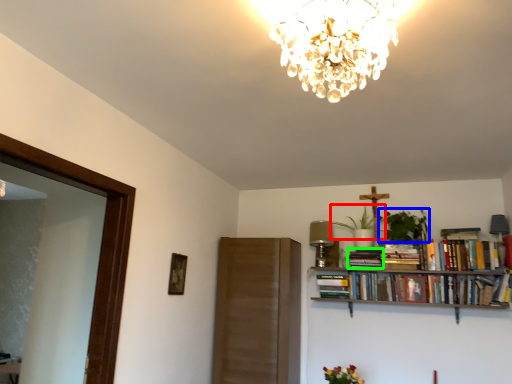
Question: Estimate the real-world distances between objects in this image. Which object is closer to plant (highlighted by a red box), plant (highlighted by a blue box) or book (highlighted by a green box)?

Choices:
 (A) plant
 (B) book

Answer: (A)